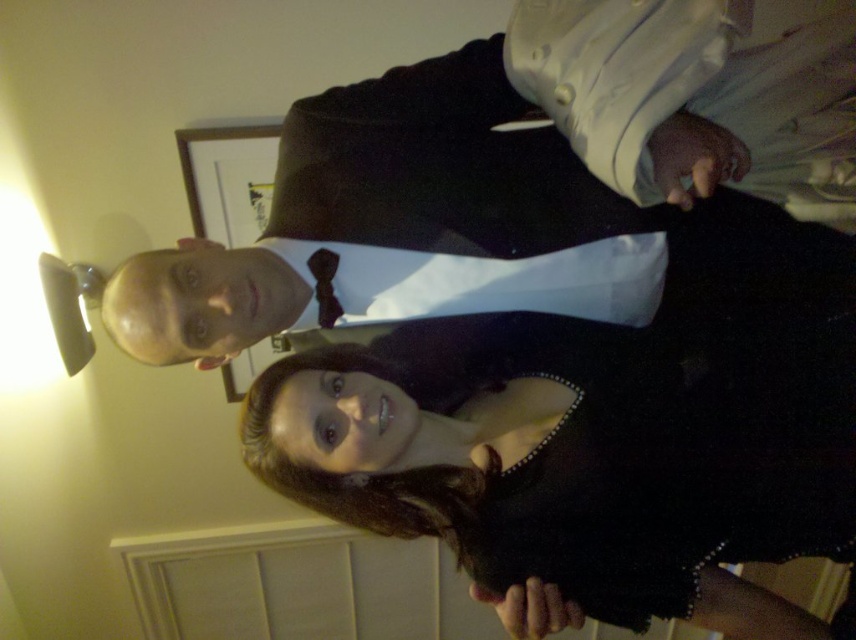
You are a photographer setting up for a formal event. You notice the matte black suit at upper center and the dark brown textured bow tie at center. Based on their positions, which one is higher in the image?

The matte black suit at upper center is located above the dark brown textured bow tie at center, so it is higher in the image.

Based on the photo, you are planning to take a photo of the black satin dress at center and the dark brown textured bow tie at center. Based on their sizes, which one will occupy more space in the photo?

The black satin dress at center has a larger size compared to the dark brown textured bow tie at center, so it will occupy more space in the photo.

You are standing in the room and want to take a photo of the point at coordinates [817,214]. The camera you are using has a minimum focus distance of 1 meter. Will the camera be able to focus on the point?

The point at coordinates [817,214] is 1.01 meters from the camera, which is just beyond the minimum focus distance of 1 meter. Therefore, the camera should be able to focus on the point as it is within the focusing range.